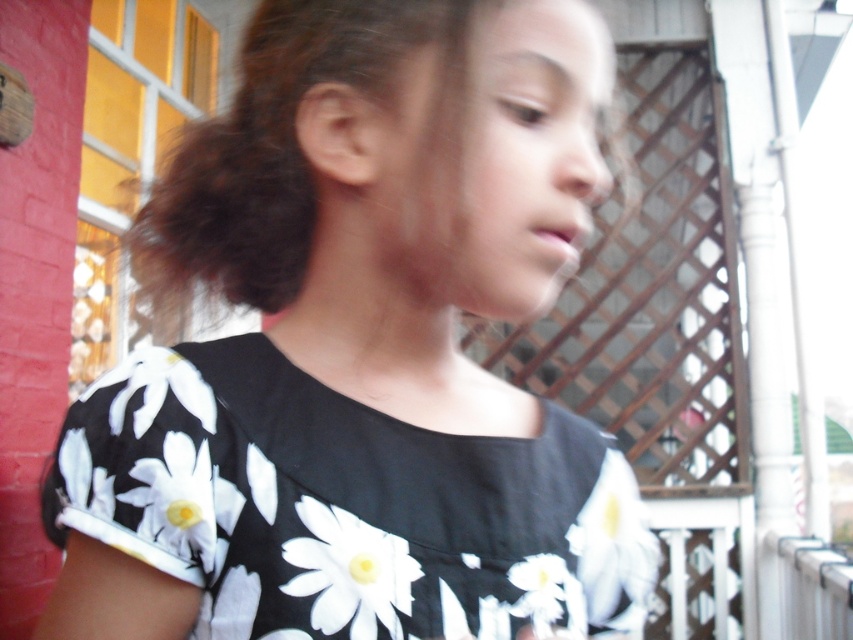
Question: Estimate the real-world distances between objects in this image. Which object is farther from the white matte daisy at center?

Choices:
 (A) black floral fabric dress at center
 (B) white matte daisy at lower right

Answer: (A)

Question: Does black floral fabric dress at center lie behind white matte daisy at center?

Choices:
 (A) no
 (B) yes

Answer: (A)

Question: Which object is closer to the camera taking this photo?

Choices:
 (A) white matte daisy at lower right
 (B) white matte daisy at center

Answer: (B)

Question: Which point is closer to the camera taking this photo?

Choices:
 (A) coord(579,592)
 (B) coord(317,557)
 (C) coord(518,256)

Answer: (B)

Question: Is black floral dress at center to the left of white matte daisy at center from the viewer's perspective?

Choices:
 (A) no
 (B) yes

Answer: (A)

Question: Is black floral fabric dress at center wider than white matte daisy at lower left?

Choices:
 (A) no
 (B) yes

Answer: (B)